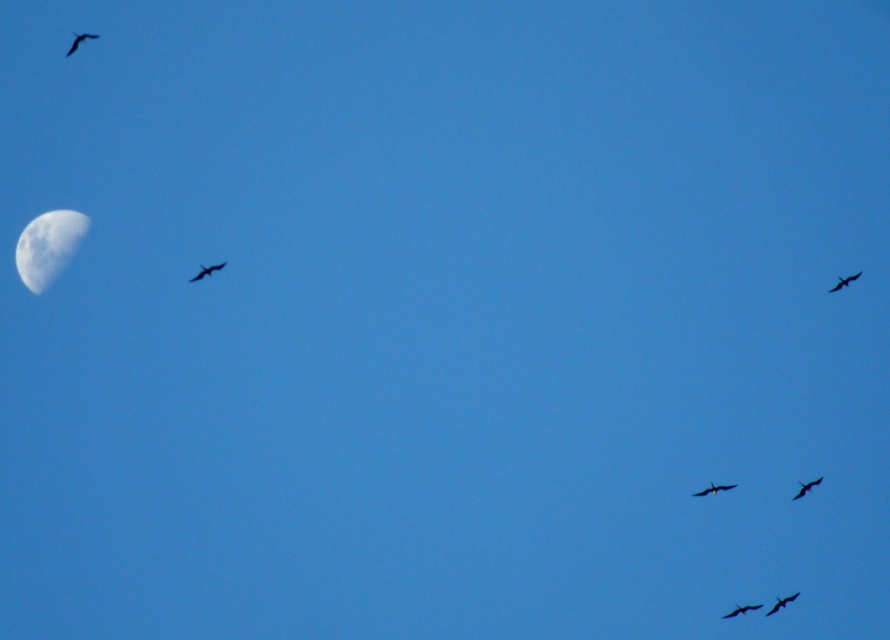
Is the position of silhouette glossy bird at lower right more distant than that of shiny black bird at lower right?

No.

Image resolution: width=890 pixels, height=640 pixels. I want to click on silhouette glossy bird at lower right, so click(741, 609).

Which is in front, point (743, 608) or point (795, 493)?

Point (743, 608)

At what (x,y) coordinates should I click in order to perform the action: click on silhouette glossy bird at lower right. Please return your answer as a coordinate pair (x, y). The height and width of the screenshot is (640, 890). Looking at the image, I should click on (741, 609).

Can you confirm if white matte moon at upper left is wider than dark feathered bird at lower right?

Indeed, white matte moon at upper left has a greater width compared to dark feathered bird at lower right.

Consider the image. Who is lower down, white matte moon at upper left or dark feathered bird at lower right?

dark feathered bird at lower right

This screenshot has height=640, width=890. What are the coordinates of `white matte moon at upper left` in the screenshot? It's located at pyautogui.click(x=47, y=246).

Between point (82, 35) and point (753, 609), which one is positioned in front?

Point (82, 35) is in front.

Who is positioned more to the right, silhouette glossy bird at upper left or silhouette glossy bird at lower right?

silhouette glossy bird at lower right

Is point (73, 42) closer to viewer compared to point (748, 611)?

Yes, it is in front of point (748, 611).

At what (x,y) coordinates should I click in order to perform the action: click on silhouette glossy bird at upper left. Please return your answer as a coordinate pair (x, y). Looking at the image, I should click on (79, 40).